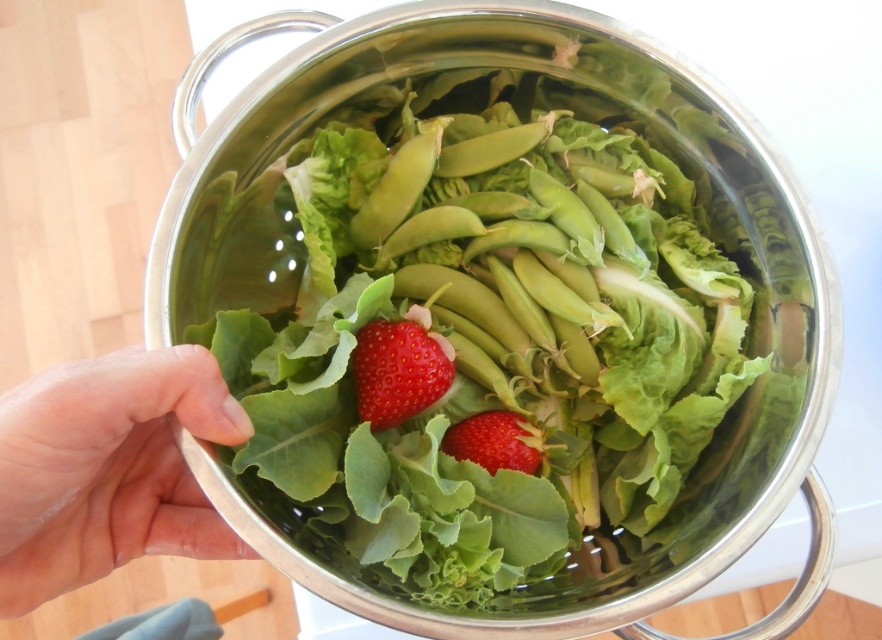
Question: Which object appears closest to the camera in this image?

Choices:
 (A) pink flesh at center
 (B) glossy red strawberry at center
 (C) red matte strawberry at center
 (D) green matte salad at center

Answer: (A)

Question: Observing the image, what is the correct spatial positioning of glossy red strawberry at center in reference to red matte strawberry at center?

Choices:
 (A) above
 (B) below

Answer: (A)

Question: Is pink flesh at center in front of red matte strawberry at center?

Choices:
 (A) no
 (B) yes

Answer: (B)

Question: Can you confirm if green matte salad at center is thinner than pink flesh at center?

Choices:
 (A) no
 (B) yes

Answer: (A)

Question: Which of the following is the closest to the observer?

Choices:
 (A) (283, 321)
 (B) (365, 390)
 (C) (23, 451)
 (D) (533, 451)

Answer: (C)

Question: Which object is the farthest from the red matte strawberry at center?

Choices:
 (A) glossy red strawberry at center
 (B) pink flesh at center

Answer: (B)